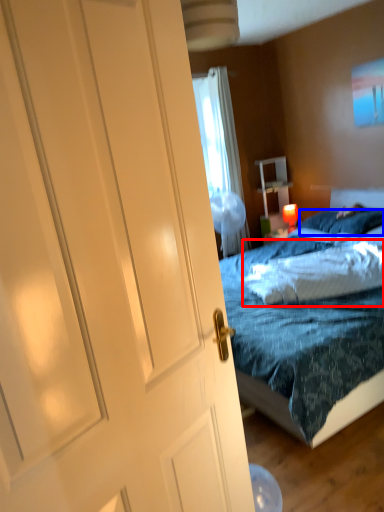
Question: Which object is further to the camera taking this photo, pillow (highlighted by a red box) or pillow (highlighted by a blue box)?

Choices:
 (A) pillow
 (B) pillow

Answer: (B)